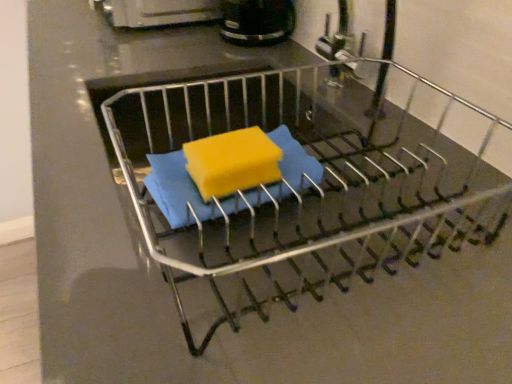
Question: Is metallic dish rack at center to the left or to the right of black plastic coffee maker at upper center in the image?

Choices:
 (A) right
 (B) left

Answer: (A)

Question: Based on their sizes in the image, would you say metallic dish rack at center is bigger or smaller than black plastic coffee maker at upper center?

Choices:
 (A) big
 (B) small

Answer: (A)

Question: Estimate the real-world distances between objects in this image. Which object is closer to the black plastic coffee maker at upper center?

Choices:
 (A) metallic dish rack at center
 (B) yellow sponge at center

Answer: (A)

Question: Estimate the real-world distances between objects in this image. Which object is closer to the metallic dish rack at center?

Choices:
 (A) black plastic coffee maker at upper center
 (B) yellow sponge at center

Answer: (B)